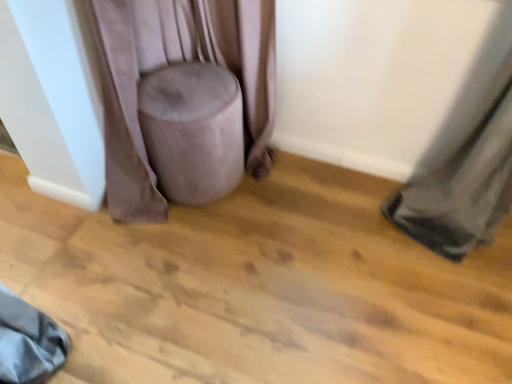
This screenshot has width=512, height=384. What do you see at coordinates (174, 62) in the screenshot?
I see `velvet beige pouf at center` at bounding box center [174, 62].

The image size is (512, 384). Identify the location of velvet beige pouf at center. (174, 62).

Locate an element on the screen. The image size is (512, 384). velvet beige pouf at center is located at coordinates (174, 62).